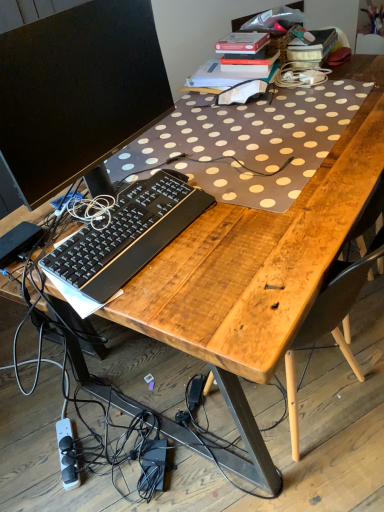
Identify the location of vacant space in front of black matte computer monitor at upper left. (192, 279).